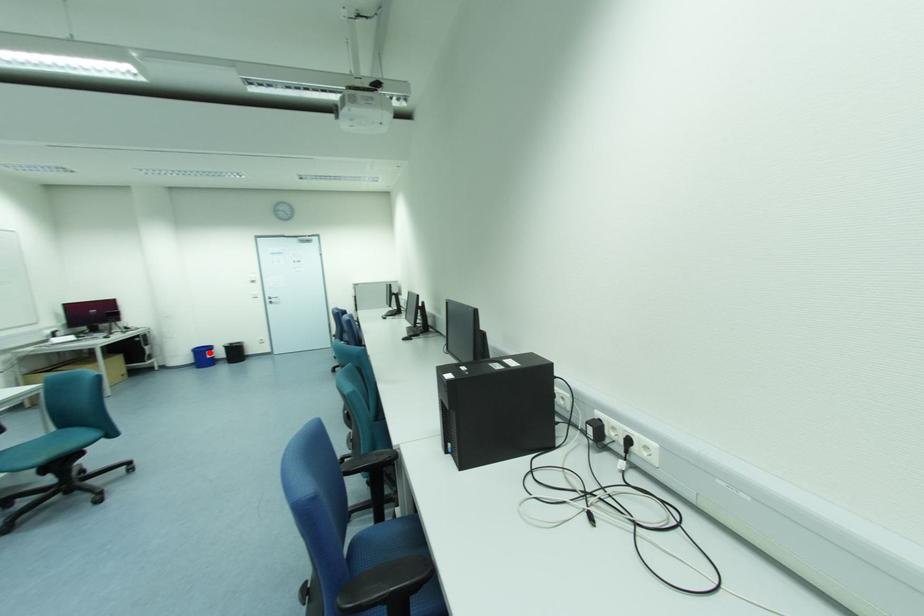
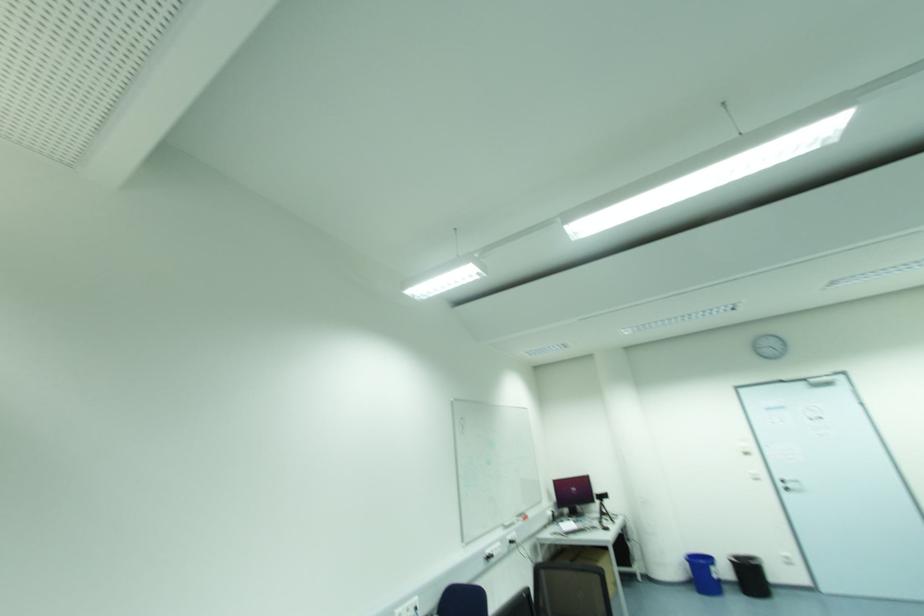
In the second image, find the point that corresponds to the highlighted location in the first image.

(714, 570)